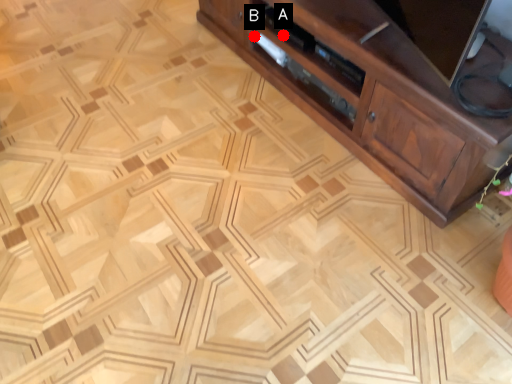
Question: Two points are circled on the image, labeled by A and B beside each circle. Which point is farther from the camera taking this photo?

Choices:
 (A) A is further
 (B) B is further

Answer: (B)